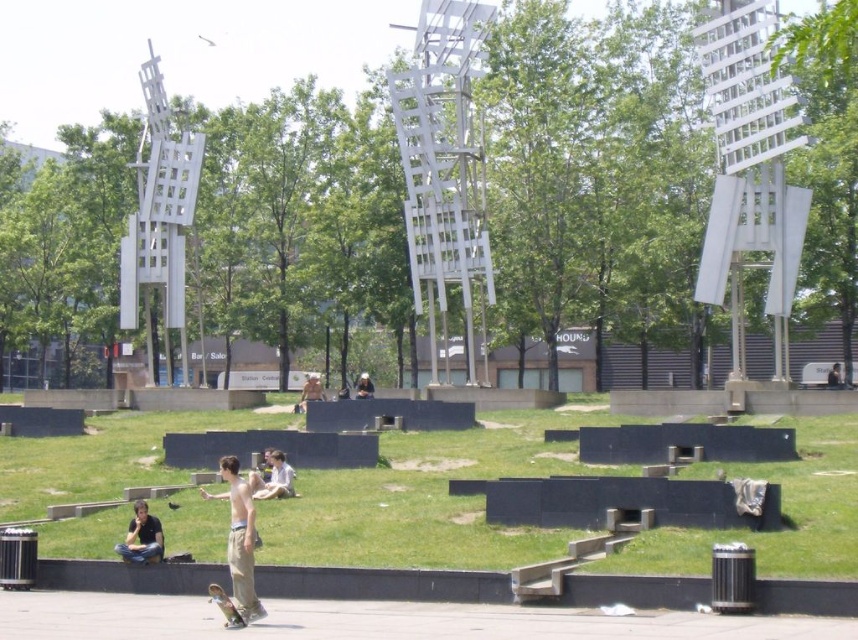
Question: Estimate the real-world distances between objects in this image. Which object is closer to the wooden skateboard at lower center?

Choices:
 (A) light blue shirt at center
 (B) dark hair person at center

Answer: (A)

Question: Does wooden skateboard at lower left appear over dark hair person at center?

Choices:
 (A) no
 (B) yes

Answer: (A)

Question: Among these objects, which one is farthest from the camera?

Choices:
 (A) green grass at lower center
 (B) matte black shirt at lower left

Answer: (B)

Question: Does light blue shirt at center have a greater width compared to tan fabric jacket at center?

Choices:
 (A) no
 (B) yes

Answer: (A)

Question: Among these objects, which one is nearest to the camera?

Choices:
 (A) green grass at lower center
 (B) light blue shirt at center
 (C) matte black shirt at lower left
 (D) tan fabric jacket at center

Answer: (A)

Question: Can you confirm if wooden skateboard at lower center is bigger than tan fabric jacket at center?

Choices:
 (A) no
 (B) yes

Answer: (A)